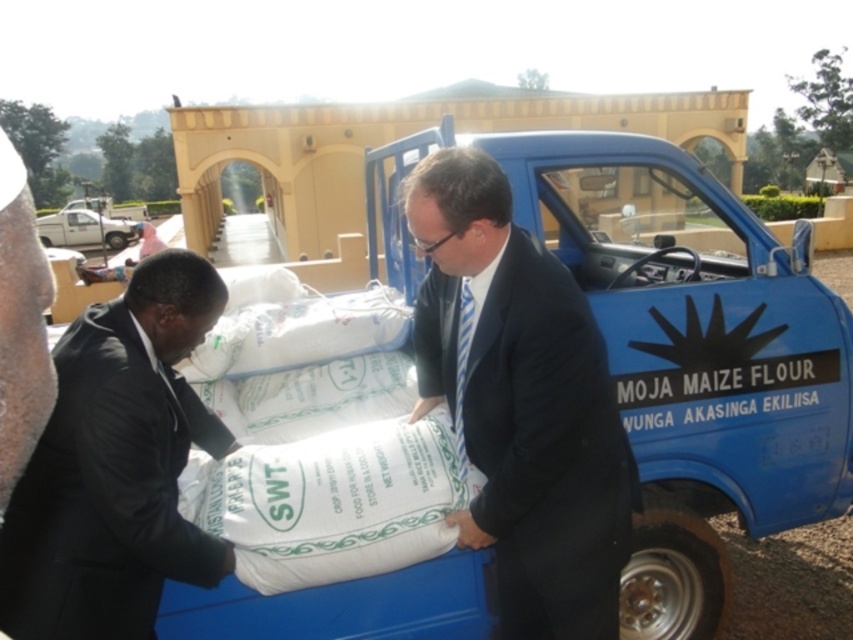
Question: Which point appears closest to the camera in this image?

Choices:
 (A) (9, 248)
 (B) (683, 595)
 (C) (131, 596)

Answer: (A)

Question: Does dark blue suit at center have a greater width compared to black matte suit at left?

Choices:
 (A) no
 (B) yes

Answer: (B)

Question: Where is white matte sack at center located in relation to dark blue suit at center in the image?

Choices:
 (A) left
 (B) right

Answer: (B)

Question: Is dark blue suit at center wider than black matte suit at left?

Choices:
 (A) yes
 (B) no

Answer: (A)

Question: Among these objects, which one is farthest from the camera?

Choices:
 (A) black matte suit at left
 (B) dark brown leather jacket at left
 (C) dark blue suit at center

Answer: (C)

Question: Which point appears farthest from the camera in this image?

Choices:
 (A) (62, 564)
 (B) (479, 176)
 (C) (596, 147)
 (D) (42, 321)

Answer: (C)